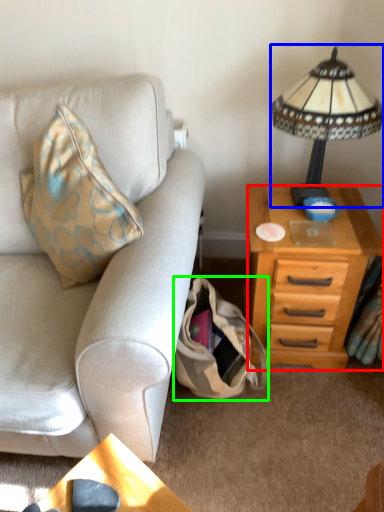
Question: Estimate the real-world distances between objects in this image. Which object is farther from nightstand (highlighted by a red box), lamp (highlighted by a blue box) or handbag (highlighted by a green box)?

Choices:
 (A) lamp
 (B) handbag

Answer: (A)